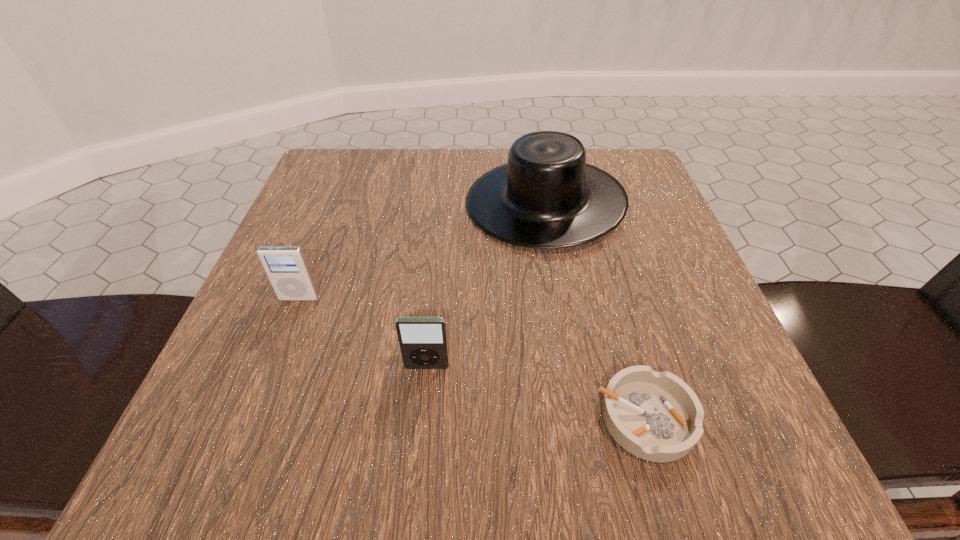
The image size is (960, 540). What are the coordinates of `unoccupied position between the nearest object and the tallest object` in the screenshot? It's located at (595, 310).

Where is `vacant area between the farthest object and the ashtray`? The image size is (960, 540). vacant area between the farthest object and the ashtray is located at coordinates (595, 310).

Where is `vacant space that is in between the farthest object and the second nearest object`? vacant space that is in between the farthest object and the second nearest object is located at coordinates (486, 285).

This screenshot has width=960, height=540. Identify the location of vacant area that lies between the dress hat and the second object from left to right. (486, 285).

This screenshot has height=540, width=960. What are the coordinates of `free area in between the farther iPod and the shortest object` in the screenshot? It's located at (472, 358).

Select which object appears as the second closest to the farthest object. Please provide its 2D coordinates. Your answer should be formatted as a tuple, i.e. [(x, y)], where the tuple contains the x and y coordinates of a point satisfying the conditions above.

[(656, 416)]

Choose which object is the nearest neighbor to the second farthest object. Please provide its 2D coordinates. Your answer should be formatted as a tuple, i.e. [(x, y)], where the tuple contains the x and y coordinates of a point satisfying the conditions above.

[(423, 343)]

The image size is (960, 540). What are the coordinates of `vacant space that satisfies the following two spatial constraints: 1. on the front-facing side of the ashtray; 2. on the left side of the nearer iPod` in the screenshot? It's located at (421, 418).

This screenshot has height=540, width=960. I want to click on free spot that satisfies the following two spatial constraints: 1. on the front-facing side of the ashtray; 2. on the right side of the second object from left to right, so click(x=421, y=418).

In order to click on free space that satisfies the following two spatial constraints: 1. on the front-facing side of the nearest object; 2. on the right side of the leftmost object in this screenshot , I will do `click(252, 418)`.